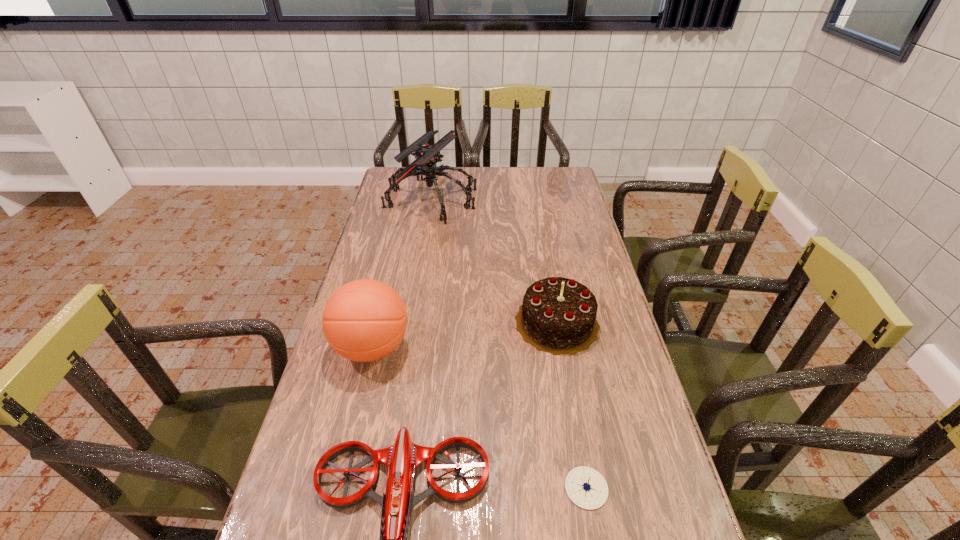
I want to click on free area in between the basketball and the third tallest object, so click(465, 335).

Identify the location of free area in between the third tallest object and the basketball. (465, 335).

Image resolution: width=960 pixels, height=540 pixels. I want to click on vacant area between the compass and the third shortest object, so click(571, 405).

Locate an element on the screen. The image size is (960, 540). vacant space in between the farther drone and the third tallest object is located at coordinates (494, 261).

Identify the location of the second closest object relative to the basketball. (558, 315).

Locate which object is the second closest to the basketball. Please provide its 2D coordinates. Your answer should be formatted as a tuple, i.e. [(x, y)], where the tuple contains the x and y coordinates of a point satisfying the conditions above.

[(558, 315)]

Find the location of a particular element. This screenshot has width=960, height=540. vacant area in the image that satisfies the following two spatial constraints: 1. on the front side of the shortest object; 2. on the left side of the basketball is located at coordinates (339, 488).

Where is `free space that satisfies the following two spatial constraints: 1. on the front side of the farthest object; 2. on the left side of the third tallest object`? Image resolution: width=960 pixels, height=540 pixels. free space that satisfies the following two spatial constraints: 1. on the front side of the farthest object; 2. on the left side of the third tallest object is located at coordinates (411, 322).